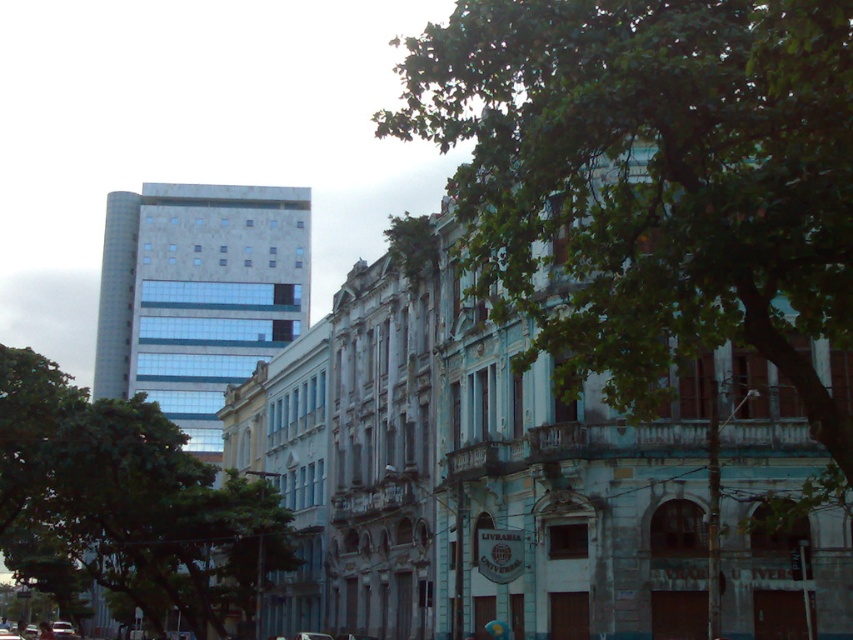
Question: Does green leafy tree at left appear on the left side of metallic silver car at lower left?

Choices:
 (A) no
 (B) yes

Answer: (A)

Question: Among these points, which one is farthest from the camera?

Choices:
 (A) (779, 291)
 (B) (73, 637)
 (C) (91, 538)

Answer: (B)

Question: Based on their relative distances, which object is nearer to the green leafy tree at center?

Choices:
 (A) metallic silver car at lower left
 (B) green leafy tree at left

Answer: (B)

Question: Does green leafy tree at center appear on the right side of green leafy tree at left?

Choices:
 (A) no
 (B) yes

Answer: (B)

Question: Which point is farther to the camera?

Choices:
 (A) green leafy tree at center
 (B) metallic silver car at lower left
 (C) green leafy tree at left

Answer: (B)

Question: Is green leafy tree at left smaller than metallic silver car at lower left?

Choices:
 (A) no
 (B) yes

Answer: (A)